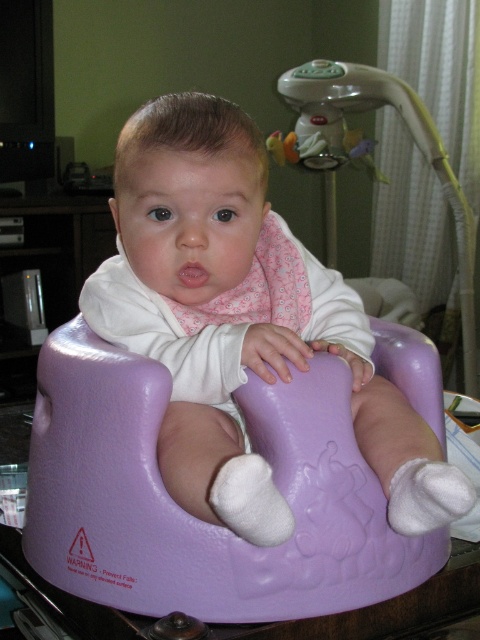
You are a parent trying to place a new toy between the matte purple bouncer at center and the purple glossy baby seat at center. The toy requires at least 10 centimeters of space. Based on the scene, can you fit the toy between them?

The matte purple bouncer at center is 7.83 centimeters away from the purple glossy baby seat at center. Since the required space for the toy is 10 centimeters, the distance between them is insufficient. You cannot fit the toy between them.

You are a childcare provider organizing the baby room. You have to move the purple glossy baby seat at center and the plastic baby swing at upper center. Which object requires more space to move around?

The plastic baby swing at upper center requires more space to move around since it occupies more space than the purple glossy baby seat at center according to the description.